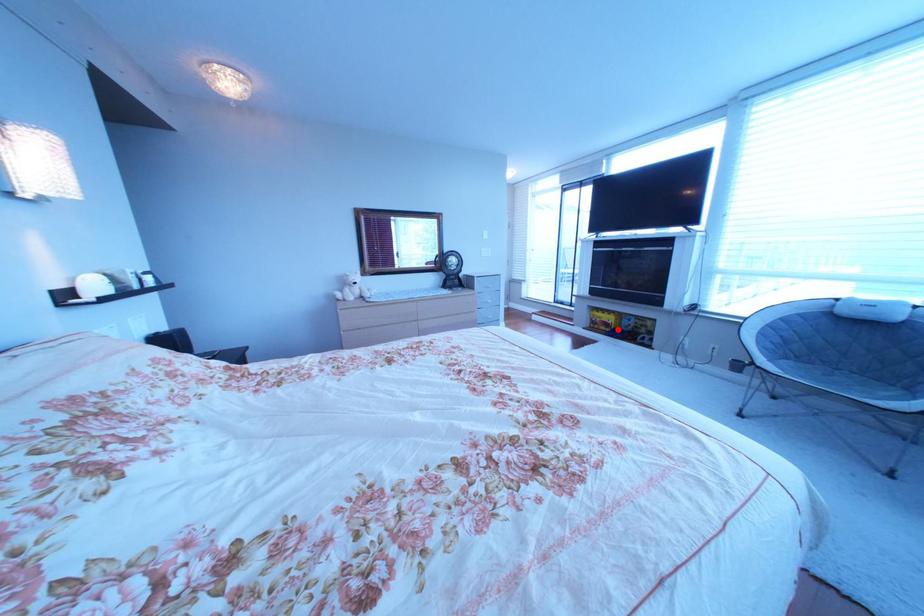
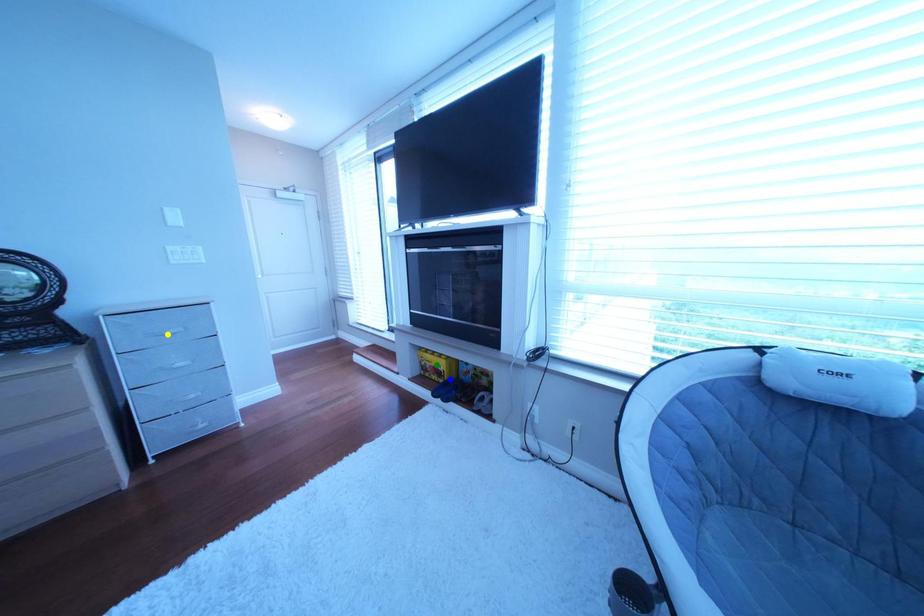
Question: I am providing you with two images of the same scene from different viewpoints. A red point is marked on the first image. You are given multiple points on the second image. Which mark in image 2 goes with the point in image 1?

Choices:
 (A) yellow point
 (B) green point
 (C) blue point

Answer: (C)